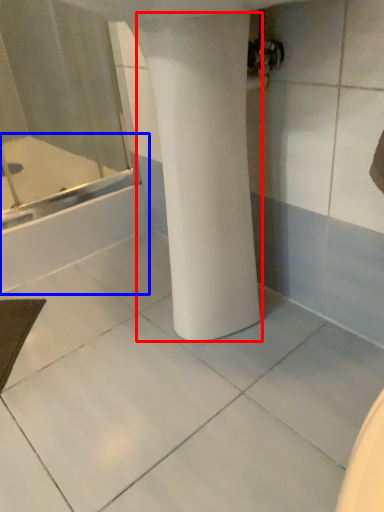
Question: Which of the following is the closest to the observer, pillar (highlighted by a red box) or bathtub (highlighted by a blue box)?

Choices:
 (A) pillar
 (B) bathtub

Answer: (A)